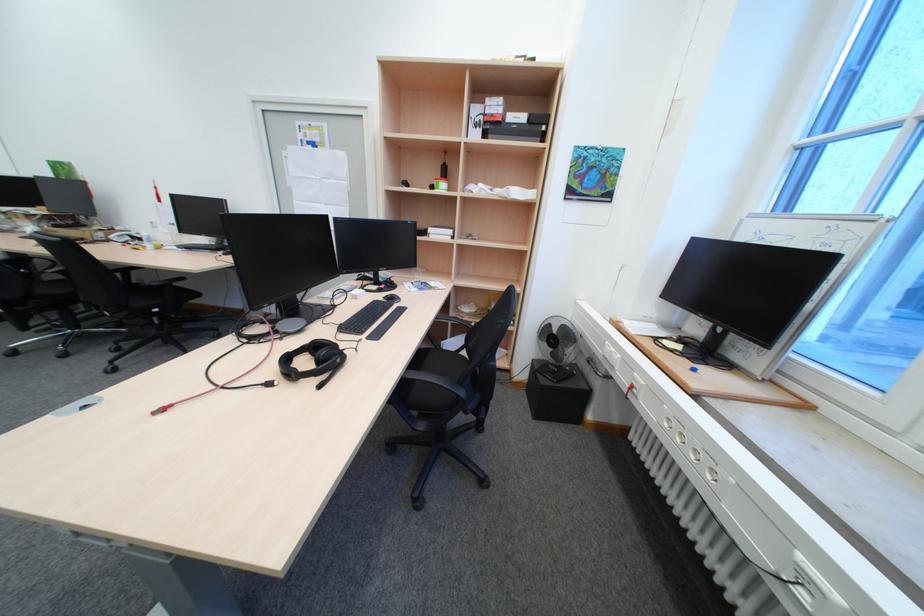
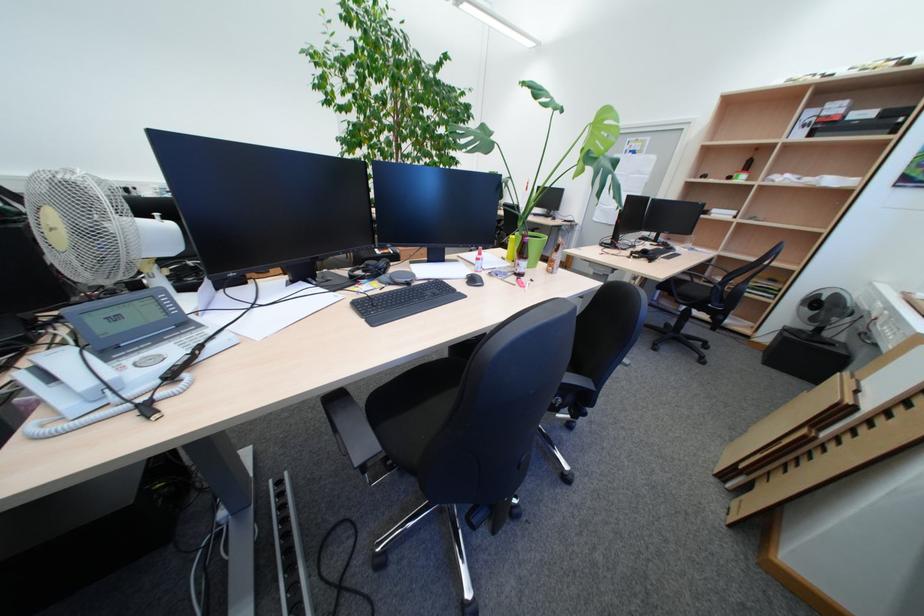
Where in the second image is the point corresponding to [444,188] from the first image?

(742, 179)